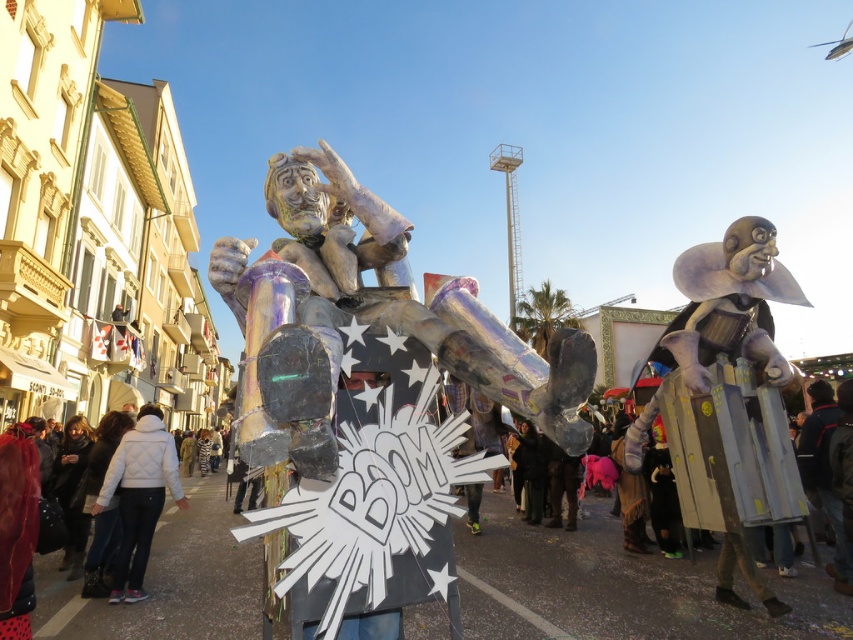
You are standing in the middle of the street looking at the two metallic sculptures. Which of the two points, point [387,218] or point [151,486], is closer to you?

Point [387,218] is closer to the viewer than point [151,486].

You are a photographer trying to capture both the iridescent metallic figure at center and the white quilted jacket at lower left in the same frame. Which object should you position closer to the camera to ensure both are in focus?

The iridescent metallic figure at center is shorter than the white quilted jacket at lower left. To ensure both are in focus, position the white quilted jacket at lower left closer to the camera since it is taller and requires less adjustment to fit within the frame.